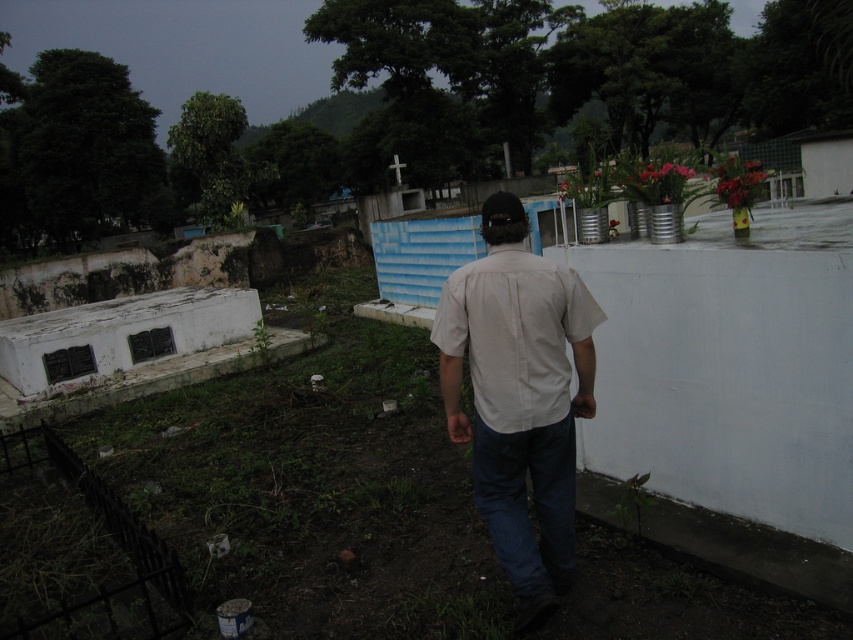
Can you confirm if white matte shirt at center is wider than white cotton shirt at center?

No.

Identify the location of white matte shirt at center. The image size is (853, 640). (519, 396).

Between point (523, 220) and point (479, 362), which one is positioned in front?

Positioned in front is point (479, 362).

The height and width of the screenshot is (640, 853). I want to click on white matte shirt at center, so click(x=519, y=396).

Between point (534, 408) and point (503, 556), which one is positioned behind?

Positioned behind is point (503, 556).

Does point (486, 417) come closer to viewer compared to point (514, 500)?

Yes.

What do you see at coordinates (515, 333) in the screenshot?
I see `white cotton shirt at center` at bounding box center [515, 333].

This screenshot has width=853, height=640. Identify the location of white cotton shirt at center. (515, 333).

Which is below, white matte shirt at center or denim at lower center?

denim at lower center is below.

Which is in front, point (485, 317) or point (573, 444)?

Point (485, 317) is more forward.

This screenshot has height=640, width=853. Find the location of `white matte shirt at center`. white matte shirt at center is located at coordinates (519, 396).